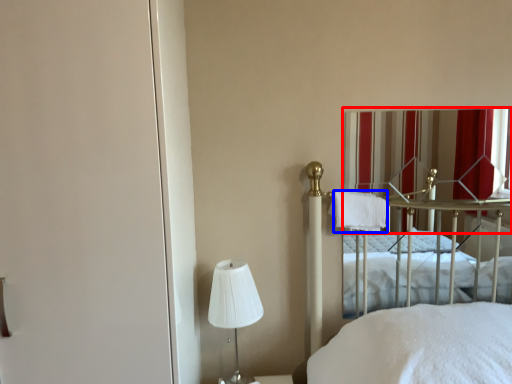
Question: Which of the following is the farthest to the observer, curtain (highlighted by a red box) or cloth (highlighted by a blue box)?

Choices:
 (A) curtain
 (B) cloth

Answer: (A)